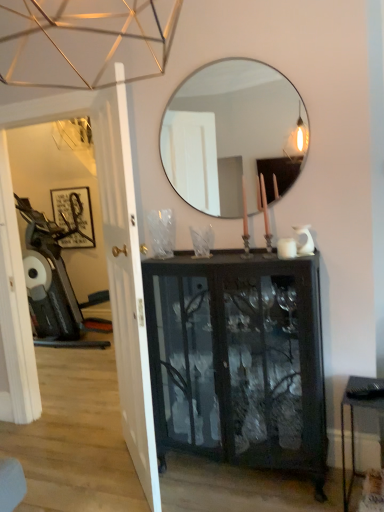
Measure the distance between point (230, 273) and camera.

Point (230, 273) and camera are 6.60 feet apart from each other.

Describe the element at coordinates (125, 279) in the screenshot. I see `white glossy door at left` at that location.

What is the approximate width of metallic silver swivel chair at left?

metallic silver swivel chair at left is 32.51 inches in width.

Where is `clear glass mirror at upper center`? clear glass mirror at upper center is located at coordinates (233, 136).

Consider the image. What's the angular difference between clear glass mirror at upper center and metallic black table at lower right's facing directions?

The angular difference between clear glass mirror at upper center and metallic black table at lower right is 5.78 degrees.

Do you think clear glass mirror at upper center is within metallic black table at lower right, or outside of it?

clear glass mirror at upper center is not inside metallic black table at lower right, it's outside.

Is clear glass mirror at upper center facing away from metallic black table at lower right?

No, clear glass mirror at upper center is not facing the opposite direction of metallic black table at lower right.

Locate an element on the screen. The image size is (384, 512). table on the right of clear glass mirror at upper center is located at coordinates (353, 423).

From the image's perspective, is metallic black table at lower right located beneath black glass cabinet at center?

Yes, from the image's perspective, metallic black table at lower right is beneath black glass cabinet at center.

Is the position of metallic black table at lower right less distant than that of black glass cabinet at center?

Yes, metallic black table at lower right is closer to the viewer.

Considering the sizes of objects metallic black table at lower right and black glass cabinet at center in the image provided, who is wider, metallic black table at lower right or black glass cabinet at center?

Wider between the two is black glass cabinet at center.

From the picture: Is metallic black table at lower right wider than matte black picture frame at left?

Yes, metallic black table at lower right is wider than matte black picture frame at left.

Considering the relative sizes of metallic black table at lower right and matte black picture frame at left in the image provided, is metallic black table at lower right bigger than matte black picture frame at left?

Yes, metallic black table at lower right is bigger than matte black picture frame at left.

Looking at this image, are metallic black table at lower right and matte black picture frame at left far apart?

That's right, there is a large distance between metallic black table at lower right and matte black picture frame at left.

Is metallic black table at lower right oriented towards matte black picture frame at left?

No, metallic black table at lower right does not turn towards matte black picture frame at left.

Is metallic black table at lower right to the left of metallic silver swivel chair at left from the viewer's perspective?

No, metallic black table at lower right is not to the left of metallic silver swivel chair at left.

Is metallic black table at lower right bigger than metallic silver swivel chair at left?

Incorrect, metallic black table at lower right is not larger than metallic silver swivel chair at left.

Relative to metallic silver swivel chair at left, is metallic black table at lower right in front or behind?

metallic black table at lower right is in front of metallic silver swivel chair at left.

From the picture: Does black glass cabinet at center contain metallic black table at lower right?

No, metallic black table at lower right is located outside of black glass cabinet at center.

Based on the photo, considering the sizes of black glass cabinet at center and metallic black table at lower right in the image, is black glass cabinet at center taller or shorter than metallic black table at lower right?

black glass cabinet at center is taller than metallic black table at lower right.

Based on their sizes in the image, would you say black glass cabinet at center is bigger or smaller than metallic black table at lower right?

Considering their sizes, black glass cabinet at center takes up more space than metallic black table at lower right.

Is black glass cabinet at center oriented away from metallic black table at lower right?

That's not correct — black glass cabinet at center is not looking away from metallic black table at lower right.

Considering the relative positions of clear glass mirror at upper center and black glass cabinet at center in the image provided, is clear glass mirror at upper center to the left of black glass cabinet at center from the viewer's perspective?

Yes.

Can you confirm if clear glass mirror at upper center is bigger than black glass cabinet at center?

No.

Is clear glass mirror at upper center oriented away from black glass cabinet at center?

That's not correct — clear glass mirror at upper center is not looking away from black glass cabinet at center.

From a real-world perspective, which object stands above the other?

clear glass mirror at upper center.

From the image's perspective, is black glass cabinet at center beneath clear glass mirror at upper center?

Yes, from the image's perspective, black glass cabinet at center is beneath clear glass mirror at upper center.

Which object is closer to the camera, black glass cabinet at center or clear glass mirror at upper center?

black glass cabinet at center is in front.

Which of these two, black glass cabinet at center or clear glass mirror at upper center, is bigger?

black glass cabinet at center is bigger.

From a real-world perspective, between black glass cabinet at center and clear glass mirror at upper center, who is vertically higher?

From a 3D spatial view, clear glass mirror at upper center is above.

Where is `mirror to the left of metallic black table at lower right`? This screenshot has height=512, width=384. mirror to the left of metallic black table at lower right is located at coordinates (233, 136).

Image resolution: width=384 pixels, height=512 pixels. What are the coordinates of `cabinetry above the metallic black table at lower right (from a real-world perspective)` in the screenshot? It's located at (238, 360).

Consider the image. Estimate the real-world distances between objects in this image. Which object is closer to matte black picture frame at left, white glossy door at left or clear glass mirror at upper center?

The object closer to matte black picture frame at left is clear glass mirror at upper center.

Which object lies further to the anchor point metallic silver swivel chair at left, black glass cabinet at center or white glossy door at left?

Among the two, black glass cabinet at center is located further to metallic silver swivel chair at left.

Looking at this image, from the image, which object appears to be farther from white glossy door at left, black glass cabinet at center or matte black picture frame at left?

The object further to white glossy door at left is matte black picture frame at left.

Looking at the image, which one is located further to white glossy door at left, black glass cabinet at center or clear glass mirror at upper center?

clear glass mirror at upper center is positioned further to the anchor white glossy door at left.

When comparing their distances from metallic silver swivel chair at left, does metallic black table at lower right or white glossy door at left seem closer?

white glossy door at left is positioned closer to the anchor metallic silver swivel chair at left.

When comparing their distances from white glossy door at left, does clear glass mirror at upper center or black glass cabinet at center seem closer?

black glass cabinet at center.

When comparing their distances from metallic black table at lower right, does metallic silver swivel chair at left or black glass cabinet at center seem further?

The object further to metallic black table at lower right is metallic silver swivel chair at left.

From the image, which object appears to be nearer to white glossy door at left, black glass cabinet at center or metallic silver swivel chair at left?

black glass cabinet at center is positioned closer to the anchor white glossy door at left.

The width and height of the screenshot is (384, 512). Identify the location of table between white glossy door at left and metallic silver swivel chair at left along the z-axis. (353, 423).

Locate an element on the screen. This screenshot has height=512, width=384. door that lies between clear glass mirror at upper center and black glass cabinet at center from top to bottom is located at coordinates (125, 279).

Where is `cabinetry located between white glossy door at left and metallic black table at lower right in the left-right direction`? cabinetry located between white glossy door at left and metallic black table at lower right in the left-right direction is located at coordinates (238, 360).

The height and width of the screenshot is (512, 384). I want to click on mirror between metallic black table at lower right and matte black picture frame at left in the front-back direction, so coord(233,136).